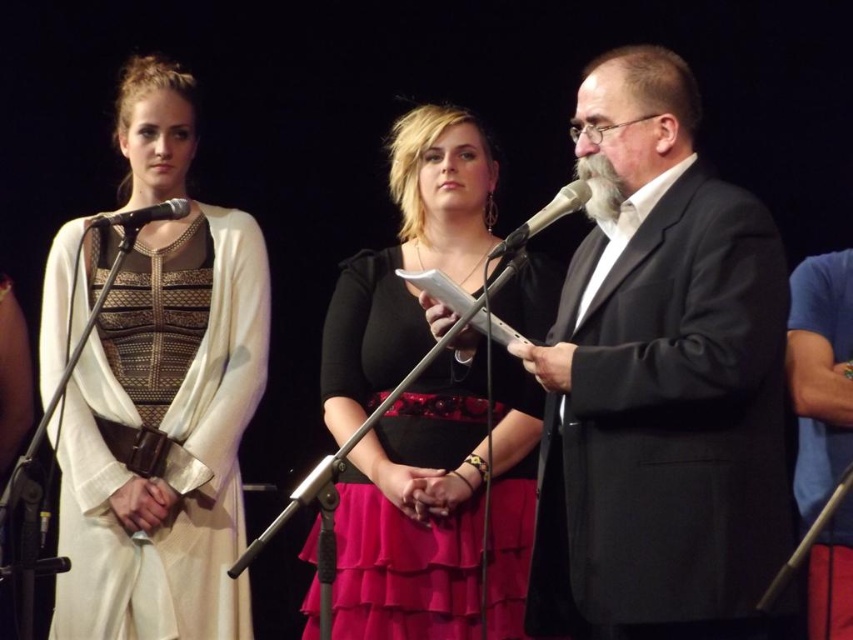
Is metallic silver microphone at center further to the viewer compared to black matte microphone at upper left?

No, metallic silver microphone at center is in front of black matte microphone at upper left.

Who is lower down, metallic silver microphone at center or black matte microphone at upper left?

metallic silver microphone at center is lower down.

Does point (540, 218) come closer to viewer compared to point (152, 212)?

Yes, point (540, 218) is closer to viewer.

Where is `metallic silver microphone at center`? The height and width of the screenshot is (640, 853). metallic silver microphone at center is located at coordinates (543, 218).

Between matte white dress at left and metallic silver microphone at center, which one appears on the right side from the viewer's perspective?

metallic silver microphone at center is more to the right.

Describe the element at coordinates (164, 436) in the screenshot. Image resolution: width=853 pixels, height=640 pixels. I see `matte white dress at left` at that location.

Where is `matte white dress at left`? matte white dress at left is located at coordinates (164, 436).

Does point (160, 424) lie behind point (354, 540)?

Yes.

Which of these two, matte white dress at left or black satin dress at center, stands shorter?

black satin dress at center

Which is behind, point (196, 620) or point (520, 568)?

Positioned behind is point (196, 620).

Locate an element on the screen. Image resolution: width=853 pixels, height=640 pixels. matte white dress at left is located at coordinates (164, 436).